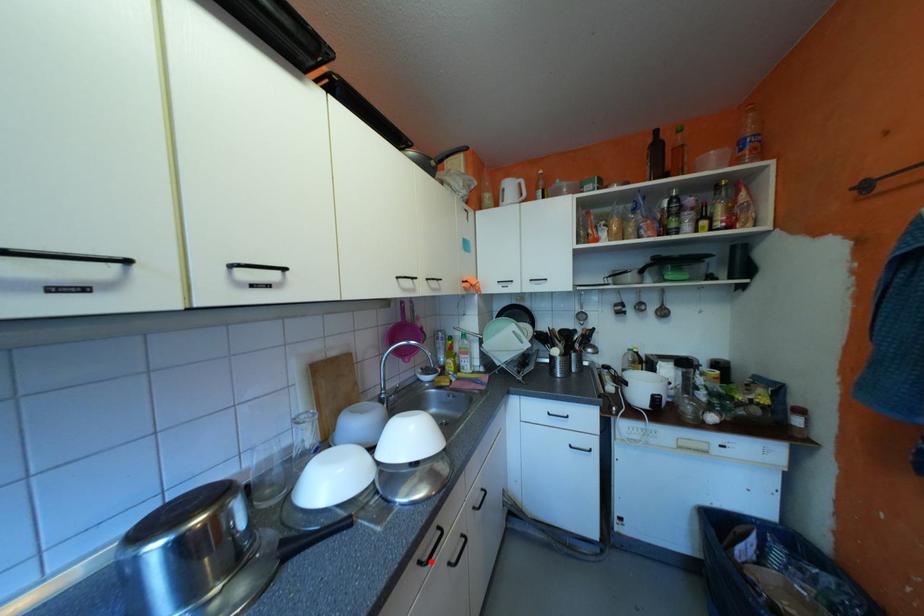
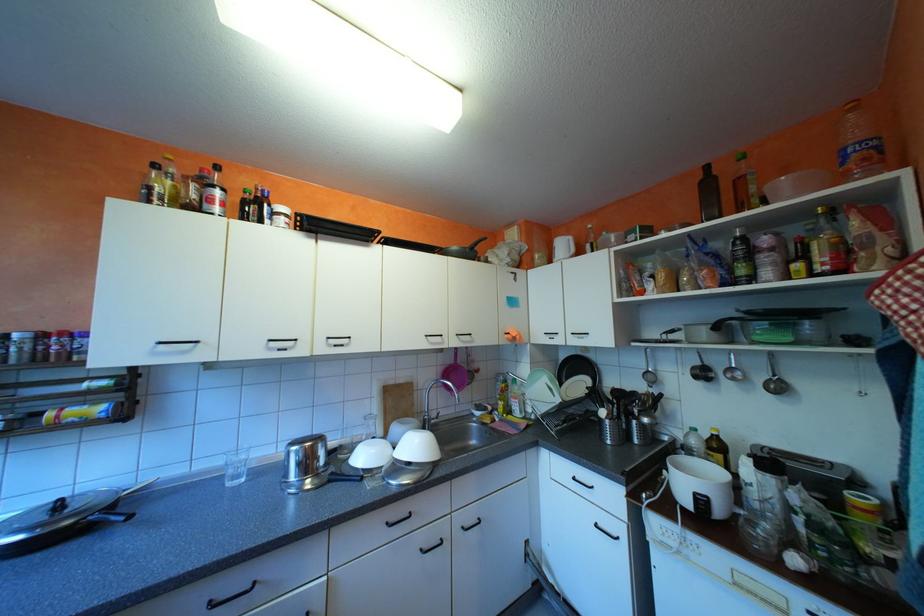
Locate, in the second image, the point that corresponds to the highlighted location in the first image.

(398, 523)